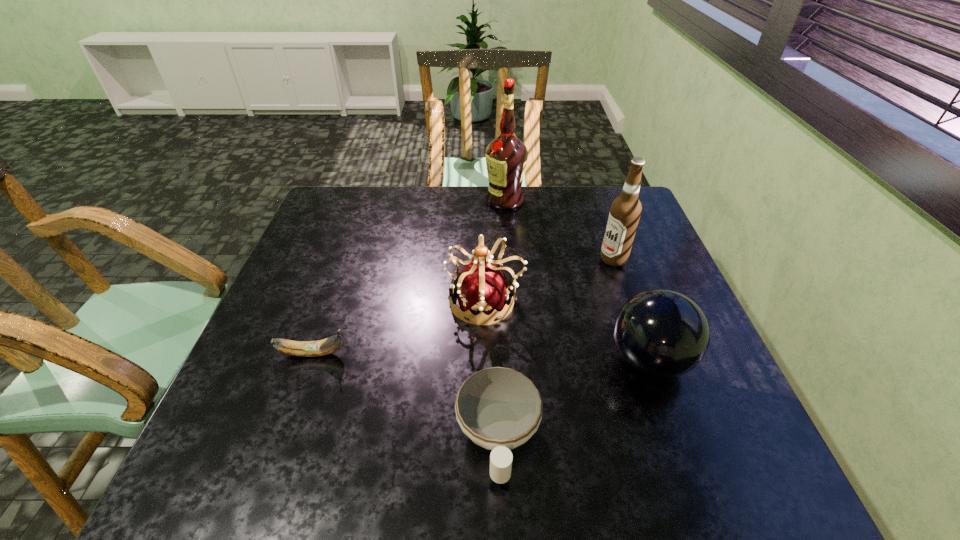
Where is `the left alcohol`? the left alcohol is located at coordinates (506, 156).

At what (x,y) coordinates should I click in order to perform the action: click on the tallest object. Please return your answer as a coordinate pair (x, y). This screenshot has width=960, height=540. Looking at the image, I should click on (506, 156).

Locate an element on the screen. The width and height of the screenshot is (960, 540). the shorter alcohol is located at coordinates (625, 211).

Locate an element on the screen. the second farthest object is located at coordinates (625, 211).

Locate an element on the screen. tiara is located at coordinates (482, 288).

I want to click on bowling ball, so click(661, 333).

Locate an element on the screen. The image size is (960, 540). the leftmost object is located at coordinates (329, 345).

This screenshot has width=960, height=540. Identify the location of chinaware. (499, 409).

Where is `vacant area located 0.250m on the label of the farthest object`? This screenshot has height=540, width=960. vacant area located 0.250m on the label of the farthest object is located at coordinates (409, 200).

The image size is (960, 540). Identify the location of vacant space situated on the label of the farthest object. (469, 200).